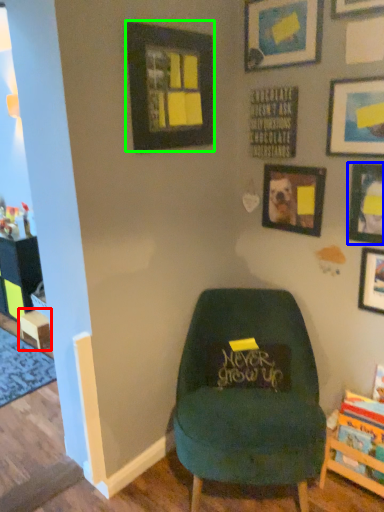
Question: Which object is positioned farthest from table (highlighted by a red box)? Select from picture frame (highlighted by a blue box) and picture frame (highlighted by a green box).

Choices:
 (A) picture frame
 (B) picture frame

Answer: (A)